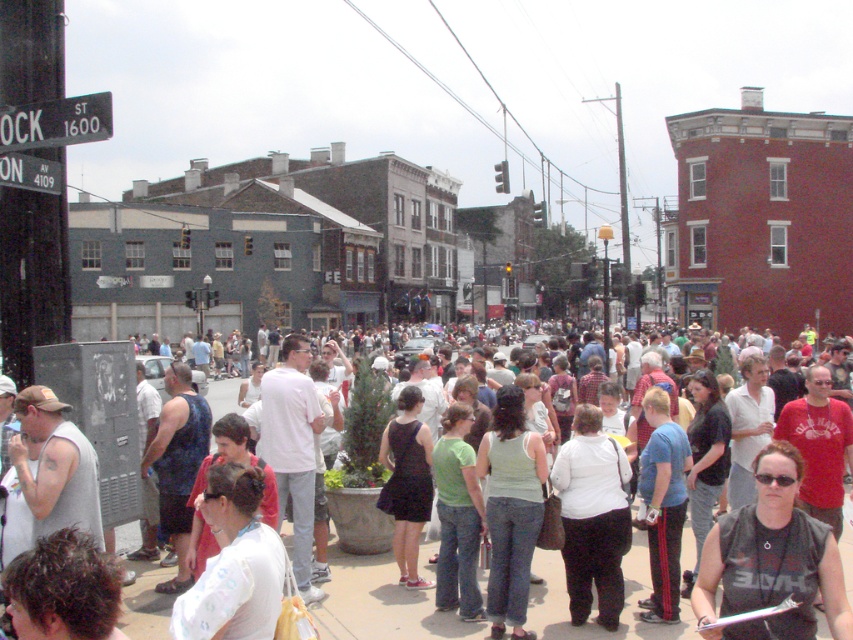
Based on the scene description, where exactly is the white fabric shirt at lower left located in the image?

The white fabric shirt at lower left is located at point (233,563).

You are standing on the sidewalk in the bustling urban street scene. You see two points marked in the image. Which point is closer to you, point (793, 634) or point (569, 483)?

Point (793, 634) is closer to you because it is in front of point (569, 483).